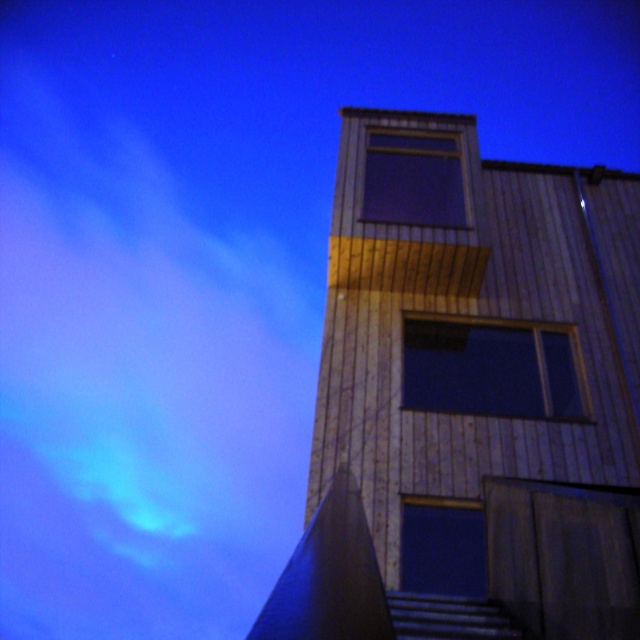
Question: Does wooden tower at center appear over dark wood window at center?

Choices:
 (A) yes
 (B) no

Answer: (A)

Question: Which point is closer to the camera taking this photo?

Choices:
 (A) (472, 580)
 (B) (378, 138)
 (C) (472, 376)

Answer: (A)

Question: Where is wooden tower at center located in relation to dark glass window at center in the image?

Choices:
 (A) right
 (B) left

Answer: (A)

Question: Which point appears closest to the camera in this image?

Choices:
 (A) (412, 403)
 (B) (410, 227)
 (C) (387, 170)
 (D) (481, 554)

Answer: (D)

Question: Which object appears farthest from the camera in this image?

Choices:
 (A) dark glass window at center
 (B) transparent glass window at upper center
 (C) dark wood window at center

Answer: (B)

Question: Does dark wood window at center appear on the left side of transparent glass window at upper center?

Choices:
 (A) yes
 (B) no

Answer: (B)